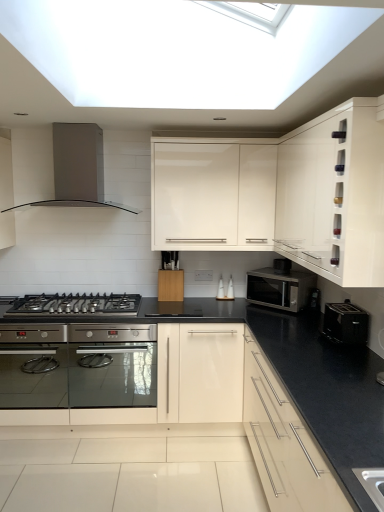
Question: From a real-world perspective, is satin silver range hood at upper left physically located above or below satin silver microwave at center-right?

Choices:
 (A) above
 (B) below

Answer: (A)

Question: Is satin silver range hood at upper left inside the boundaries of satin silver microwave at center-right, or outside?

Choices:
 (A) inside
 (B) outside

Answer: (B)

Question: Which is nearer to the satin silver range hood at upper left?

Choices:
 (A) black plastic toaster at right, the 1th appliance from the top
 (B) black plastic toaster at right, which is the 2th appliance in left-to-right order
 (C) white glossy cabinet at upper right, positioned as the 2th cabinetry in bottom-to-top order
 (D) white glossy cabinet at upper center, arranged as the 3th cabinetry when ordered from the bottom
 (E) satin silver microwave at center-right

Answer: (D)

Question: Which is farther from the matte white cabinet at lower right, placed as the first cabinetry when sorted from bottom to top?

Choices:
 (A) white glossy cabinet at upper center, arranged as the 3th cabinetry when ordered from the bottom
 (B) black stainless steel gas stove at lower left
 (C) white glossy cabinet at upper right, which is the 2th cabinetry from top to bottom
 (D) black plastic toaster at right, the 1th appliance from the left
 (E) black plastic toaster at right, positioned as the first appliance in front-to-back order

Answer: (B)